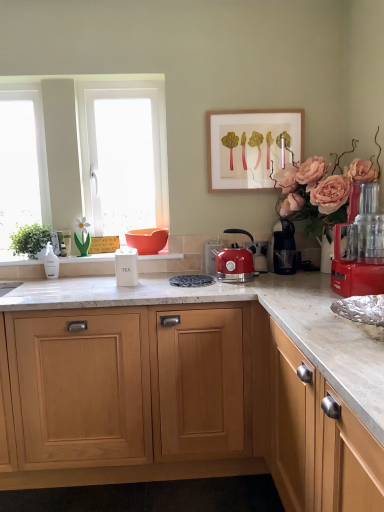
Where is `vacant area situated to the left side of white matte tea container at center, acting as the 4th kitchen appliance starting from the right`? This screenshot has height=512, width=384. vacant area situated to the left side of white matte tea container at center, acting as the 4th kitchen appliance starting from the right is located at coordinates (88, 288).